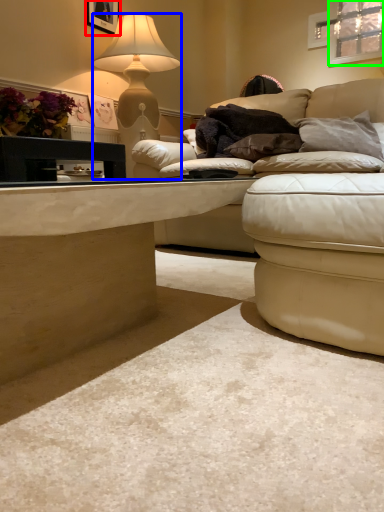
Question: Based on their relative distances, which object is nearer to picture frame (highlighted by a red box)? Choose from lamp (highlighted by a blue box) and window (highlighted by a green box).

Choices:
 (A) lamp
 (B) window

Answer: (A)